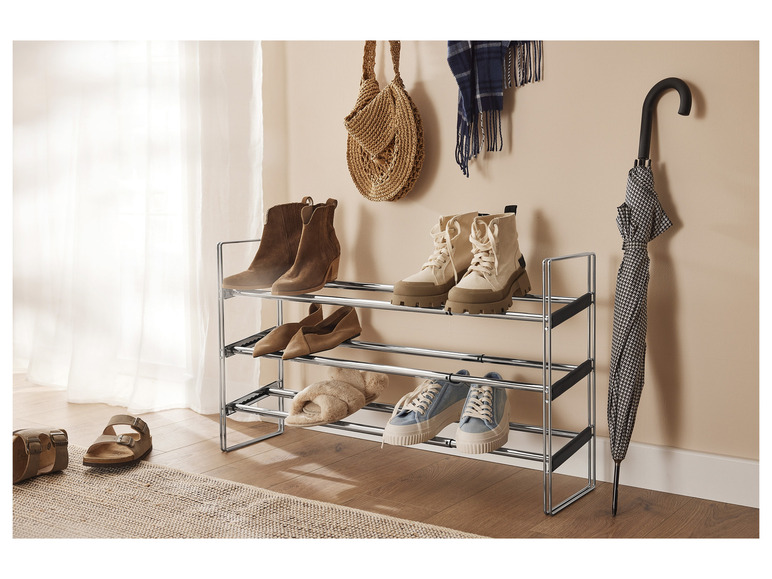
This screenshot has width=772, height=579. Identify the location of footware on shelves. (485, 293), (427, 288), (313, 277), (278, 240), (279, 340), (320, 347), (329, 400), (418, 423), (479, 436).